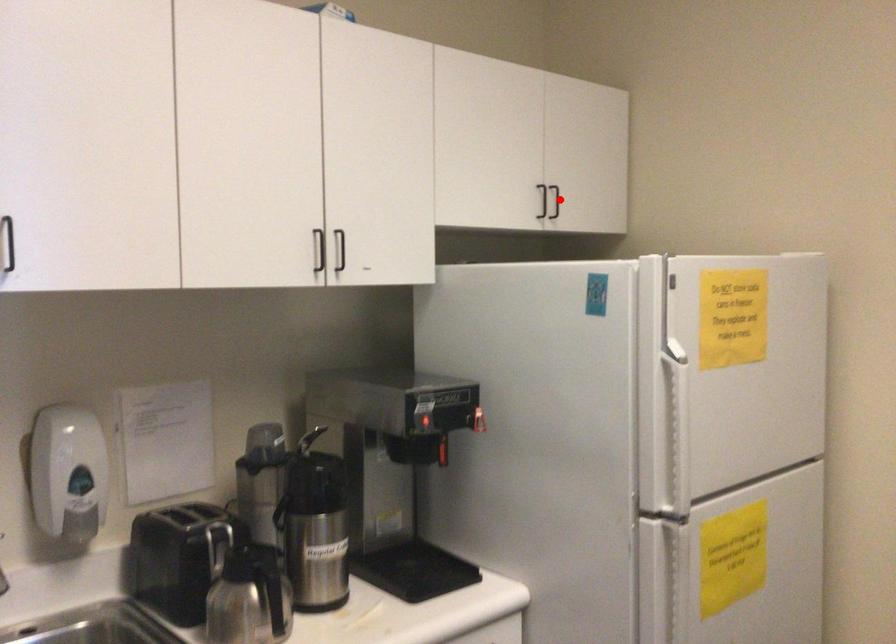
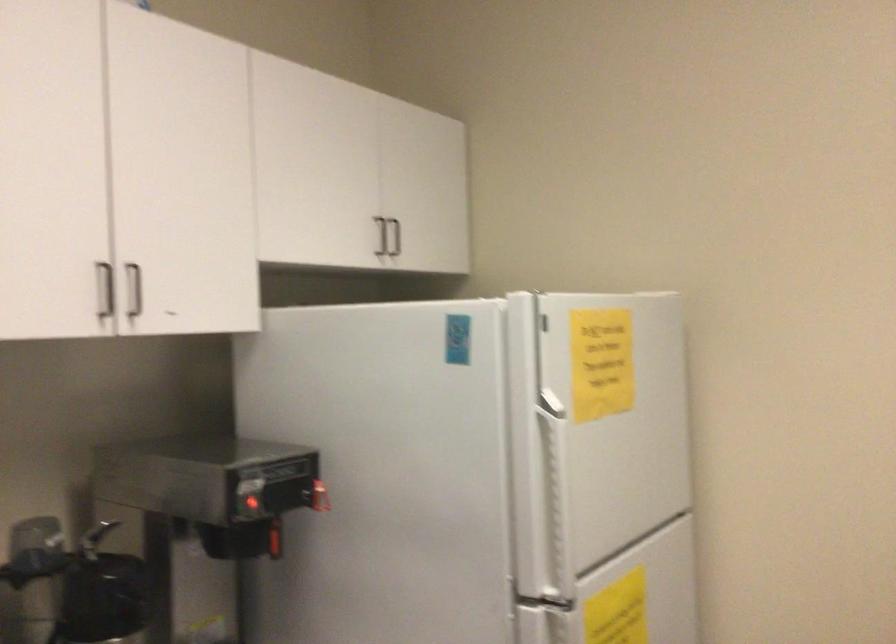
Question: I am providing you with two images of the same scene from different viewpoints. In image1, a red point is highlighted. Considering the same 3D point in image2, which of the following is correct?

Choices:
 (A) It is closer
 (B) It is farther

Answer: (A)